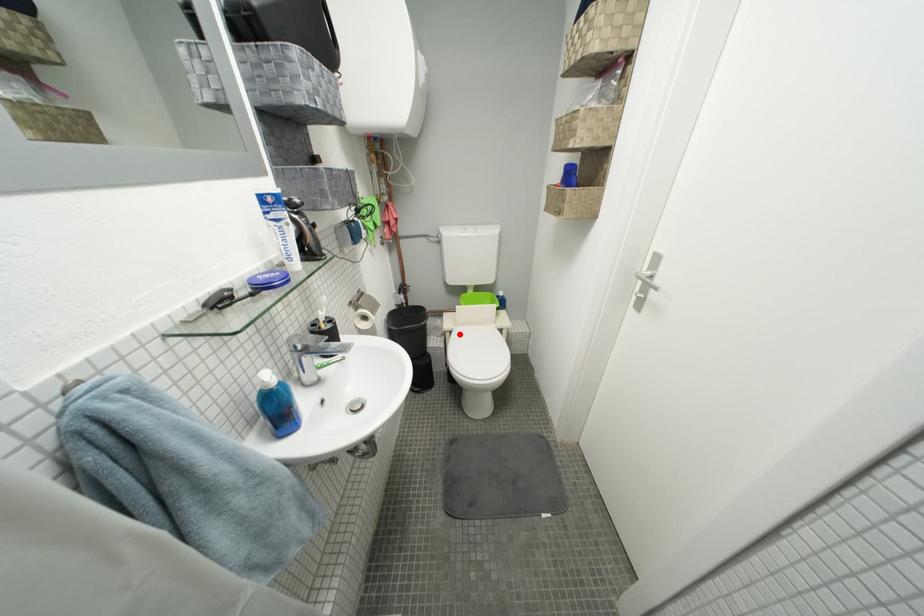
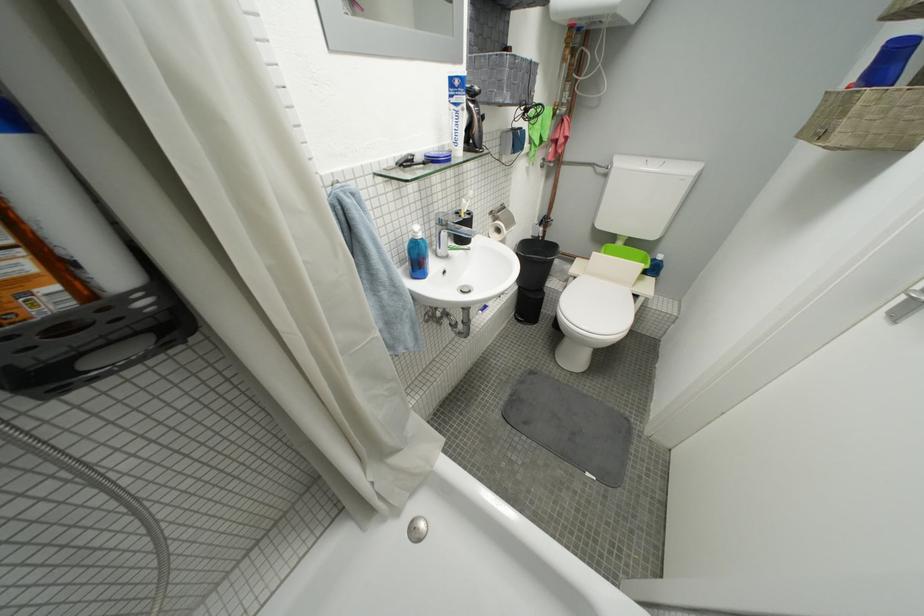
In the second image, find the point that corresponds to the highlighted location in the first image.

(584, 281)